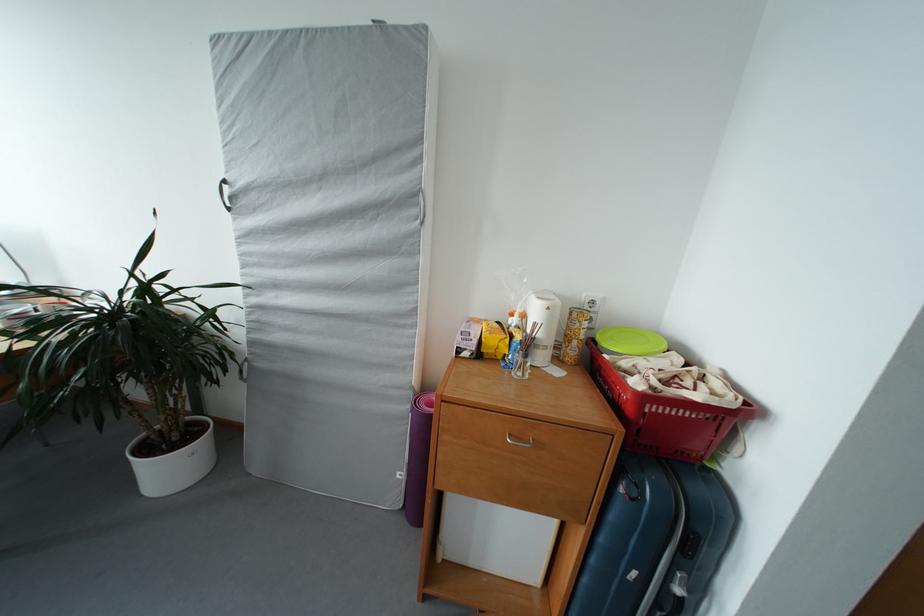
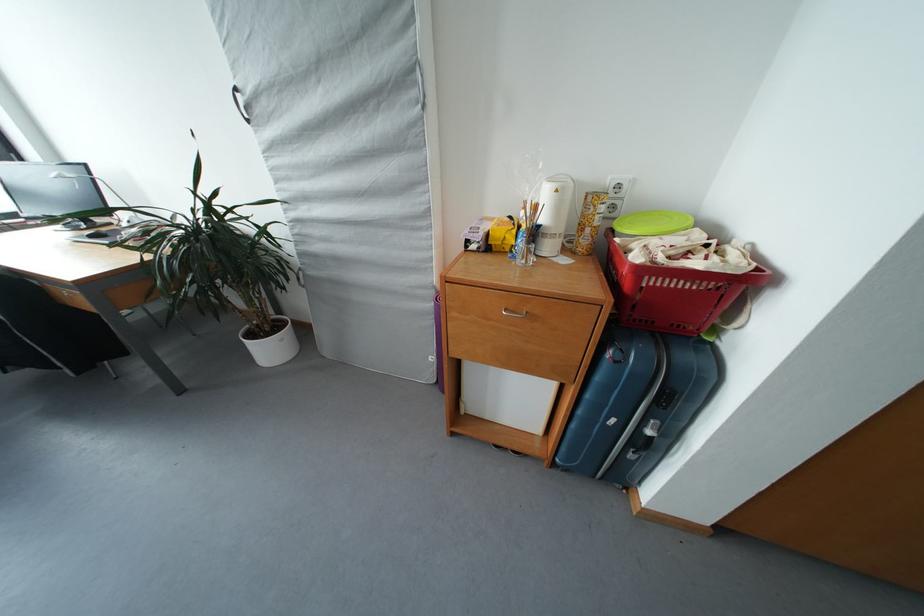
Question: I am providing you with two images of the same scene from different viewpoints. Which of the following objects are not visible in image2?

Choices:
 (A) small glass cup
 (B) computer mouse
 (C) green plastic lid
 (D) none of these

Answer: (D)